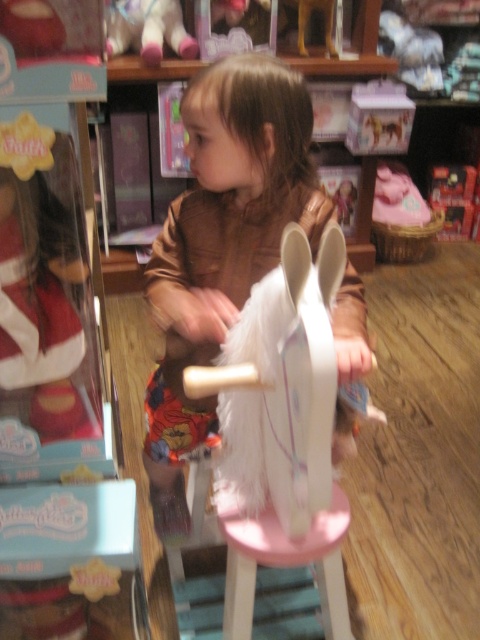
Can you confirm if brown plush jacket at center is thinner than pink wood stool at center?

No, brown plush jacket at center is not thinner than pink wood stool at center.

The width and height of the screenshot is (480, 640). What do you see at coordinates (222, 246) in the screenshot?
I see `brown plush jacket at center` at bounding box center [222, 246].

You are a GUI agent. You are given a task and a screenshot of the screen. Output one action in this format:
    pyautogui.click(x=<x>, y=<y>)
    Task: Click on the brown plush jacket at center
    This screenshot has width=480, height=640.
    Given the screenshot: What is the action you would take?
    pyautogui.click(x=222, y=246)

At what (x,y) coordinates should I click in order to perform the action: click on brown plush jacket at center. Please return your answer as a coordinate pair (x, y). Looking at the image, I should click on (222, 246).

Is white furry horse at center positioned before velvet plush bear at upper left?

That is True.

Can you confirm if white furry horse at center is wider than velvet plush bear at upper left?

No.

Is point (294, 449) closer to viewer compared to point (158, 22)?

Yes, point (294, 449) is in front of point (158, 22).

At what (x,y) coordinates should I click in order to perform the action: click on white furry horse at center. Please return your answer as a coordinate pair (x, y). This screenshot has width=480, height=640. Looking at the image, I should click on 278,387.

Does brown plush jacket at center appear on the left side of velvet plush bear at upper left?

No, brown plush jacket at center is not to the left of velvet plush bear at upper left.

Between brown plush jacket at center and velvet plush bear at upper left, which one has more height?

Standing taller between the two is brown plush jacket at center.

Who is more forward, (159, 305) or (107, 38)?

Point (159, 305)

Locate an element on the screen. Image resolution: width=480 pixels, height=640 pixels. brown plush jacket at center is located at coordinates (222, 246).